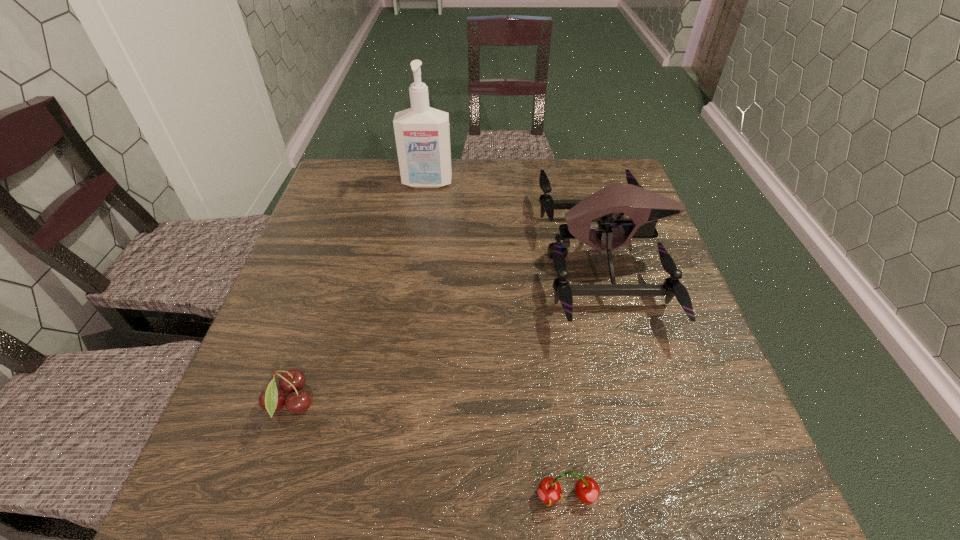
The image size is (960, 540). Find the location of `empty space that is in between the second farthest object and the right cherry`. empty space that is in between the second farthest object and the right cherry is located at coordinates (586, 377).

This screenshot has height=540, width=960. Find the location of `vacant space that's between the leftmost object and the nearer cherry`. vacant space that's between the leftmost object and the nearer cherry is located at coordinates (429, 450).

You are a GUI agent. You are given a task and a screenshot of the screen. Output one action in this format:
    pyautogui.click(x=<x>, y=<y>)
    Task: Click on the vacant space in between the nearer cherry and the farther cherry
    Image resolution: width=960 pixels, height=540 pixels.
    Given the screenshot: What is the action you would take?
    pyautogui.click(x=429, y=450)

Locate an element on the screen. This screenshot has height=540, width=960. vacant point located between the farthest object and the right cherry is located at coordinates tap(497, 340).

Locate an element on the screen. Image resolution: width=960 pixels, height=540 pixels. free point between the right cherry and the leftmost object is located at coordinates pyautogui.click(x=429, y=450).

This screenshot has width=960, height=540. I want to click on the third closest object relative to the farther cherry, so click(422, 134).

Locate which object is the closest to the nearest object. Please provide its 2D coordinates. Your answer should be formatted as a tuple, i.e. [(x, y)], where the tuple contains the x and y coordinates of a point satisfying the conditions above.

[(644, 207)]

The width and height of the screenshot is (960, 540). Find the location of `blank area in the image that satisfies the following two spatial constraints: 1. on the front-facing side of the third shortest object; 2. with stems pointing upwards on the right cherry`. blank area in the image that satisfies the following two spatial constraints: 1. on the front-facing side of the third shortest object; 2. with stems pointing upwards on the right cherry is located at coordinates (674, 496).

Locate an element on the screen. Image resolution: width=960 pixels, height=540 pixels. blank area in the image that satisfies the following two spatial constraints: 1. on the front label of the tallest object; 2. on the leaves of the leftmost object is located at coordinates click(x=394, y=403).

You are a GUI agent. You are given a task and a screenshot of the screen. Output one action in this format:
    pyautogui.click(x=<x>, y=<y>)
    Task: Click on the vacant point that satisfies the following two spatial constraints: 1. on the front-facing side of the drone; 2. with stems pointing upwards on the nearest object
    
    Given the screenshot: What is the action you would take?
    pyautogui.click(x=674, y=496)